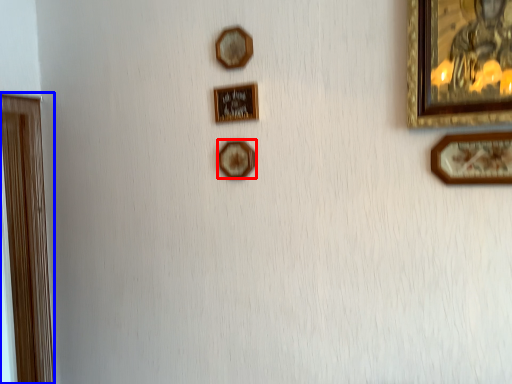
Question: Which object is further to the camera taking this photo, picture frame (highlighted by a red box) or picture frame (highlighted by a blue box)?

Choices:
 (A) picture frame
 (B) picture frame

Answer: (B)